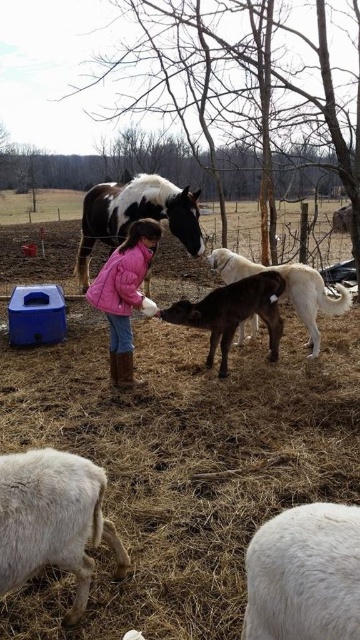
You are standing at the center of the image and want to approach the spotted glossy horse at center. Which direction should you move to reach it?

The spotted glossy horse at center is already at the center of the image, so you donot need to move in any direction to reach it.

You are a photographer trying to capture a clear shot of both the white woolen sheep at lower right and the brown glossy pony at center. However, the pony is blocking your view of the sheep. Can you adjust your position to see both animals without moving them? Explain why or why not based on their positions.

The white woolen sheep at lower right is positioned under the brown glossy pony at center, so adjusting your position might allow you to angle the camera downward or shift sideways to see both. Since the sheep is beneath the pony, moving the camera position could reveal the sheep without needing to move the animals.

You are a farmer who needs to move a fence post from the white woolen sheep at lower right to the brown glossy pony at center. The fence post is 3 meters long. Can you carry it horizontally between them without bending it?

The distance between the white woolen sheep at lower right and the brown glossy pony at center is 4.13 meters. Since the fence post is only 3 meters long, it cannot reach that distance when carried horizontally. You would need a longer post or adjust the path.